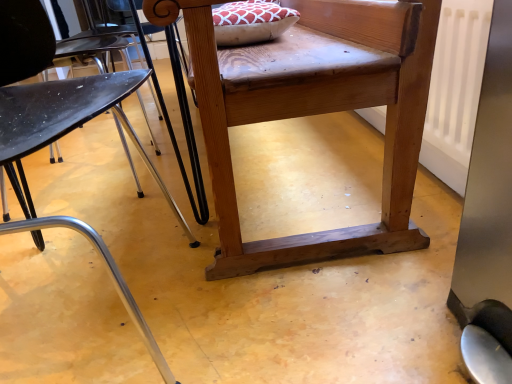
Question: Does metallic black chair at left have a lesser height compared to natural wood chair at center?

Choices:
 (A) yes
 (B) no

Answer: (B)

Question: Is the depth of metallic black chair at left greater than that of natural wood chair at center?

Choices:
 (A) no
 (B) yes

Answer: (A)

Question: Does metallic black chair at left have a lesser width compared to natural wood chair at center?

Choices:
 (A) no
 (B) yes

Answer: (B)

Question: Can you confirm if metallic black chair at left is smaller than natural wood chair at center?

Choices:
 (A) no
 (B) yes

Answer: (B)

Question: From the image's perspective, is metallic black chair at left below natural wood chair at center?

Choices:
 (A) yes
 (B) no

Answer: (A)

Question: Is metallic black chair at left not close to natural wood chair at center?

Choices:
 (A) no
 (B) yes

Answer: (A)

Question: Is natural wood chair at center outside metallic black chair at left?

Choices:
 (A) no
 (B) yes

Answer: (B)

Question: Considering the relative sizes of natural wood chair at center and metallic black chair at left in the image provided, is natural wood chair at center shorter than metallic black chair at left?

Choices:
 (A) no
 (B) yes

Answer: (B)

Question: Is natural wood chair at center wider than metallic black chair at left?

Choices:
 (A) no
 (B) yes

Answer: (B)

Question: Is natural wood chair at center bigger than metallic black chair at left?

Choices:
 (A) yes
 (B) no

Answer: (A)

Question: Does natural wood chair at center touch metallic black chair at left?

Choices:
 (A) yes
 (B) no

Answer: (B)

Question: From a real-world perspective, is natural wood chair at center on metallic black chair at left?

Choices:
 (A) yes
 (B) no

Answer: (B)

Question: Is natural wood chair at center inside the boundaries of metallic black chair at left, or outside?

Choices:
 (A) inside
 (B) outside

Answer: (B)